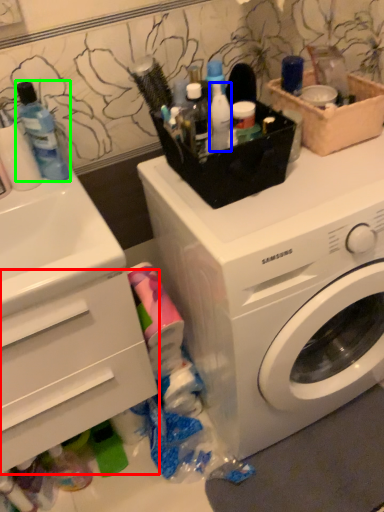
Question: Which is farther away from drawer (highlighted by a red box)? toiletry (highlighted by a blue box) or mouthwash (highlighted by a green box)?

Choices:
 (A) toiletry
 (B) mouthwash

Answer: (A)